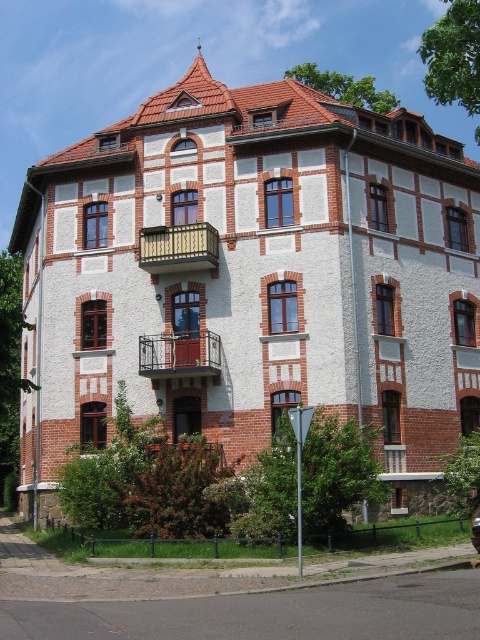
Question: Which object is farther from the camera taking this photo?

Choices:
 (A) rustic metal balcony at center
 (B) brown wooden balcony at center

Answer: (B)

Question: Does brown wooden balcony at center come in front of rustic metal balcony at center?

Choices:
 (A) yes
 (B) no

Answer: (B)

Question: Is brown wooden balcony at center bigger than rustic metal balcony at center?

Choices:
 (A) yes
 (B) no

Answer: (B)

Question: Can you confirm if brown wooden balcony at center is positioned to the right of rustic metal balcony at center?

Choices:
 (A) yes
 (B) no

Answer: (B)